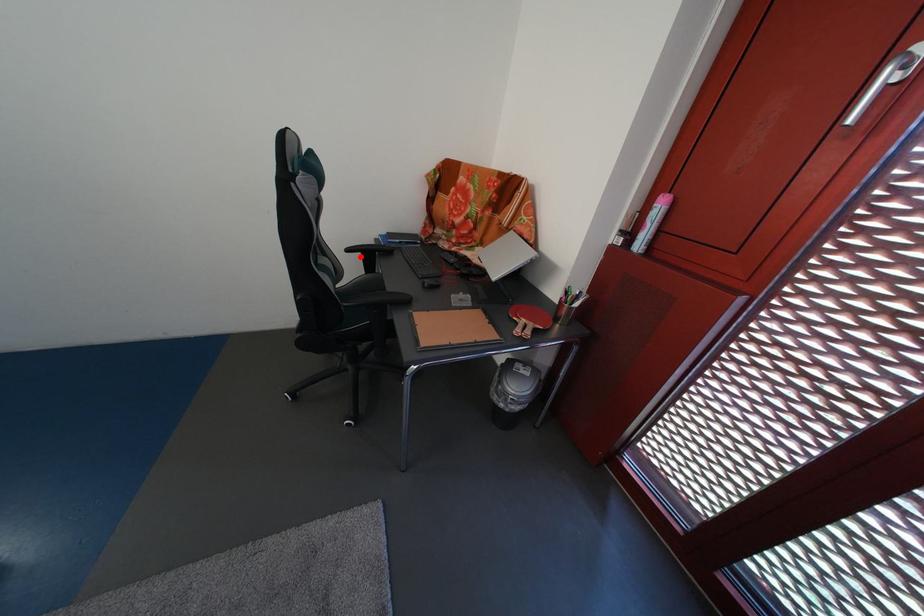
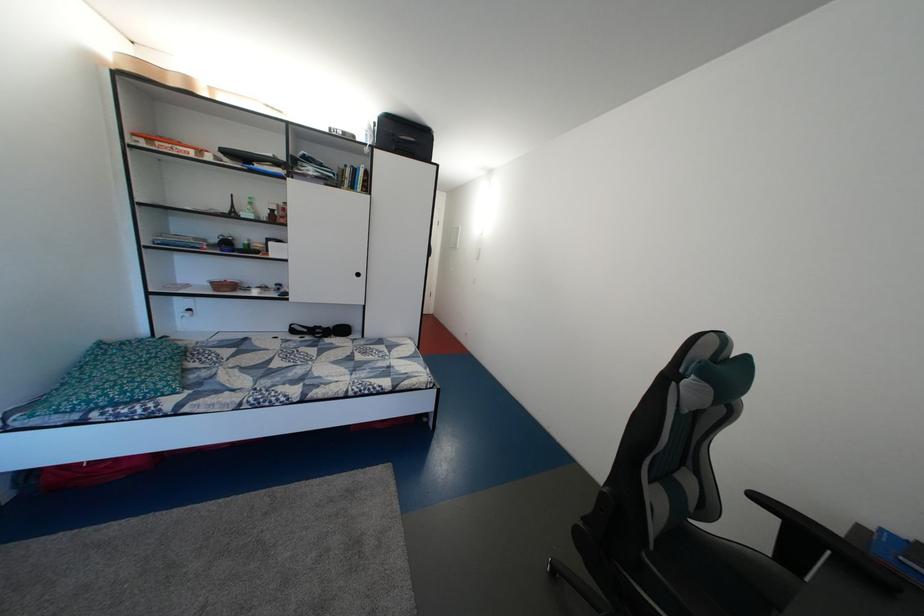
Question: I am providing you with two images of the same scene from different viewpoints. In image1, a red point is highlighted. Considering the same 3D point in image2, which of the following is correct?

Choices:
 (A) It is closer
 (B) It is farther

Answer: (B)